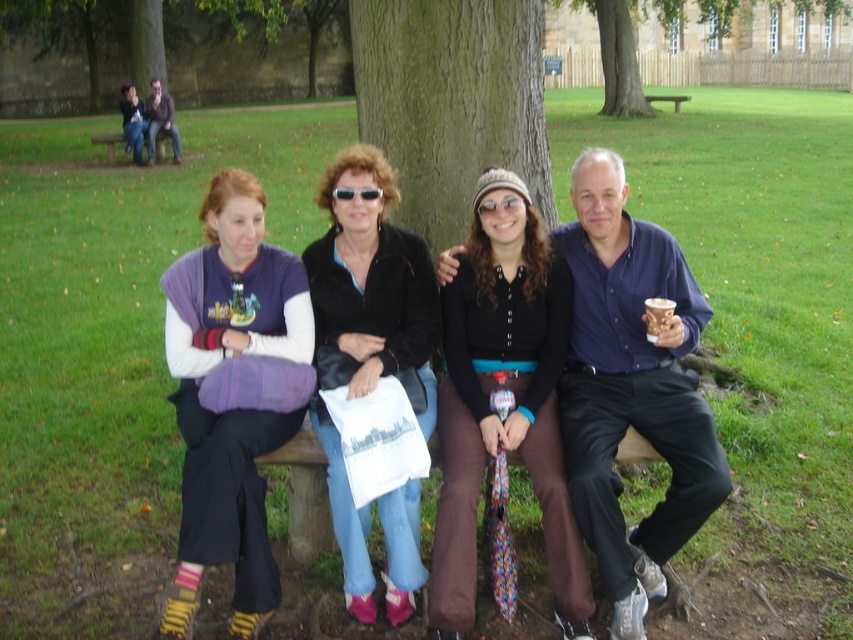
Consider the image. Is brown rough bark tree at center to the left of matte purple sweater at upper left from the viewer's perspective?

In fact, brown rough bark tree at center is to the right of matte purple sweater at upper left.

Who is higher up, brown rough bark tree at center or matte purple sweater at upper left?

matte purple sweater at upper left

Is point (419, 200) closer to viewer compared to point (123, 115)?

Yes, it is in front of point (123, 115).

At what (x,y) coordinates should I click in order to perform the action: click on brown rough bark tree at center. Please return your answer as a coordinate pair (x, y). This screenshot has width=853, height=640. Looking at the image, I should click on (451, 102).

Who is more forward, (247, 376) or (376, 195)?

Point (247, 376) is more forward.

Locate an element on the screen. matte purple sweater at left is located at coordinates (x=231, y=396).

In the scene shown: Between blue shirt at center and brown wooden bench at upper left, which one appears on the right side from the viewer's perspective?

blue shirt at center is more to the right.

Consider the image. Between blue shirt at center and brown wooden bench at upper left, which one is positioned lower?

blue shirt at center is lower down.

Describe the element at coordinates (631, 387) in the screenshot. I see `blue shirt at center` at that location.

This screenshot has width=853, height=640. I want to click on blue shirt at center, so click(631, 387).